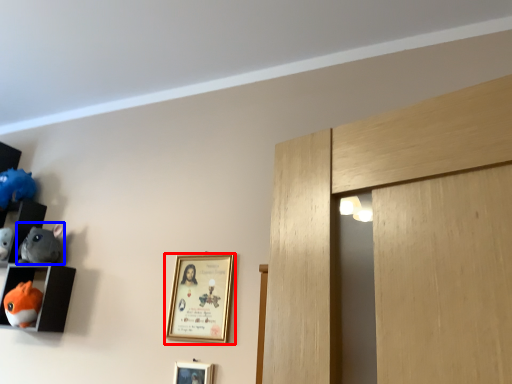
Question: Which object appears farthest to the camera in this image, picture frame (highlighted by a red box) or toy (highlighted by a blue box)?

Choices:
 (A) picture frame
 (B) toy

Answer: (B)